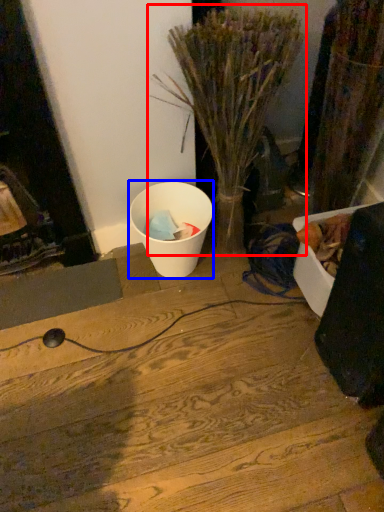
Question: Which object appears closest to the camera in this image, houseplant (highlighted by a red box) or waste (highlighted by a blue box)?

Choices:
 (A) houseplant
 (B) waste

Answer: (A)